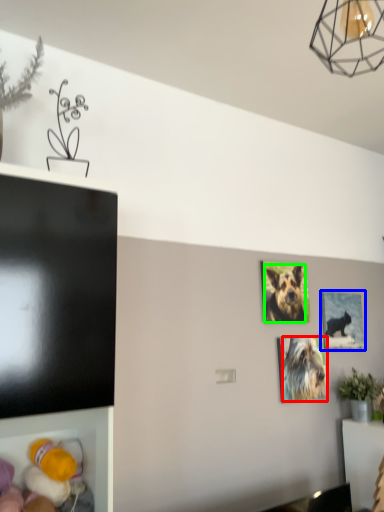
Question: Estimate the real-world distances between objects in this image. Which object is closer to dog (highlighted by a red box), picture frame (highlighted by a blue box) or dog (highlighted by a green box)?

Choices:
 (A) picture frame
 (B) dog

Answer: (B)